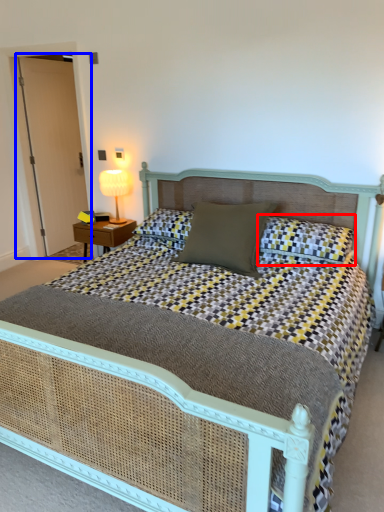
Question: Which object appears closest to the camera in this image, pillow (highlighted by a red box) or glass door (highlighted by a blue box)?

Choices:
 (A) pillow
 (B) glass door

Answer: (A)